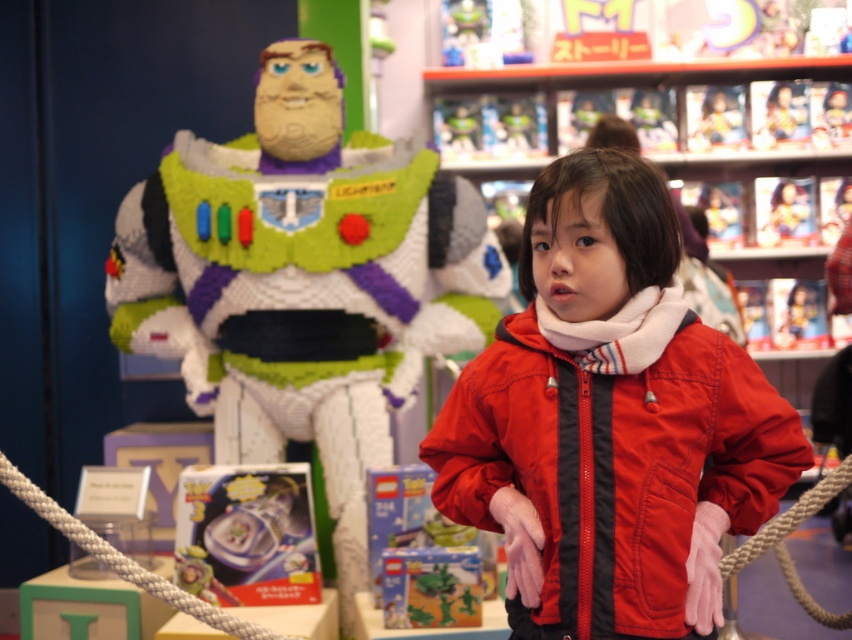
You are a customer in the toy store and want to take a photo of the LEGO Buzz Lightyear model. You notice two points in the scene marked as point 1 at coordinates (634,252) and point 2 at coordinates (291,273). Which point is closer to you when you are standing in front of the display?

Point 1 at coordinates (634,252) is closer to the viewer than point 2 at coordinates (291,273).

You are a customer in the toy store looking at the LEGO display. You see the red matte jacket at center and the white lego figure at center. Which one is positioned more to the right side of the display?

The red matte jacket at center is positioned to the right of the white lego figure at center, so the red matte jacket at center is more to the right side of the display.